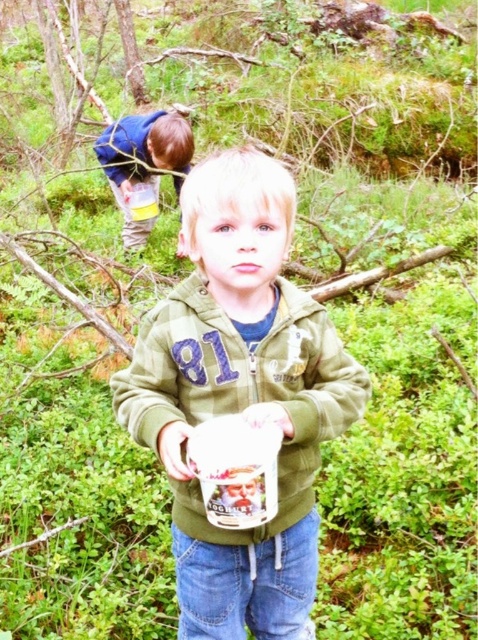
Between point (281, 202) and point (136, 145), which one is positioned in front?

Point (281, 202)

Is green matte jacket at center further to the viewer compared to blue denim pants at upper left?

That is False.

The height and width of the screenshot is (640, 478). What do you see at coordinates (240, 396) in the screenshot? I see `green matte jacket at center` at bounding box center [240, 396].

I want to click on green matte jacket at center, so click(240, 396).